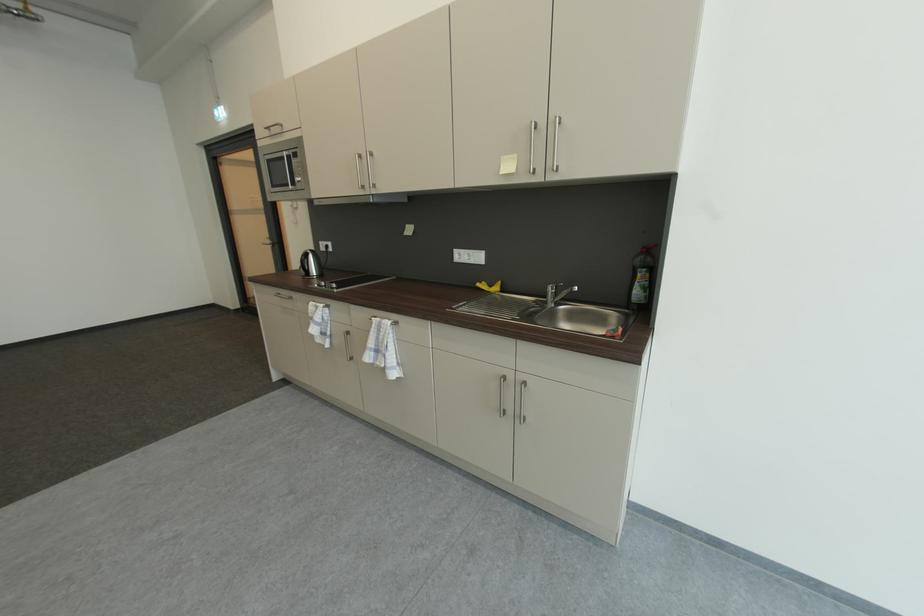
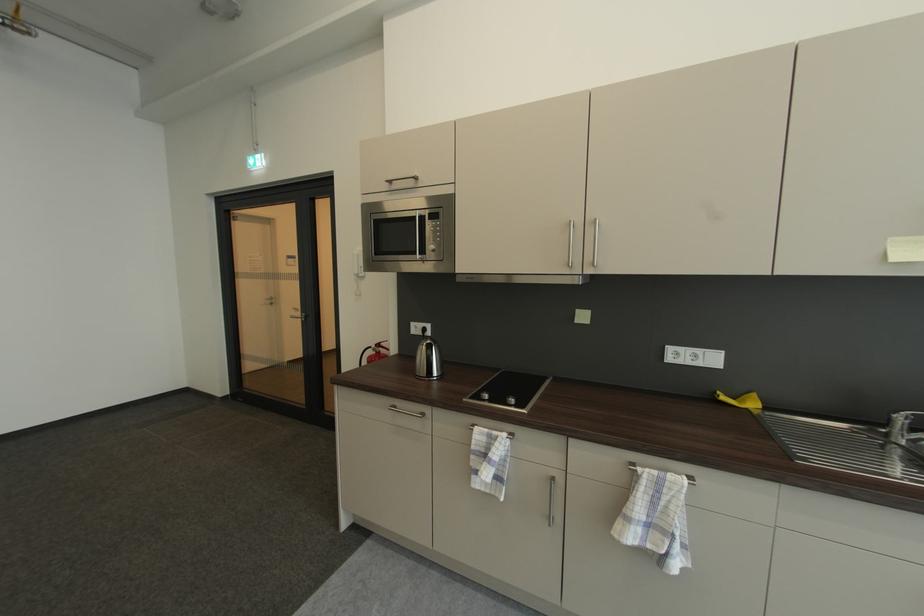
Where in the second image is the point corresponding to pixel 299 155 from the first image?

(436, 215)